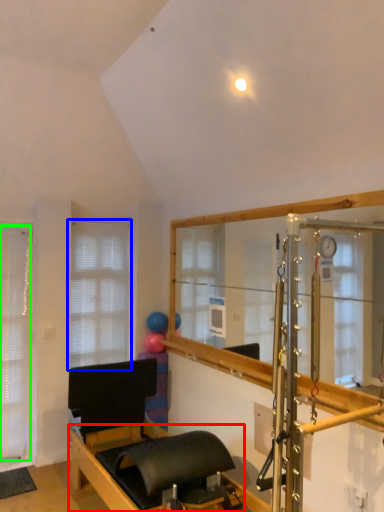
Question: Based on their relative distances, which object is farther from bed frame (highlighted by a red box)? Choose from window (highlighted by a blue box) and blind (highlighted by a green box).

Choices:
 (A) window
 (B) blind

Answer: (A)